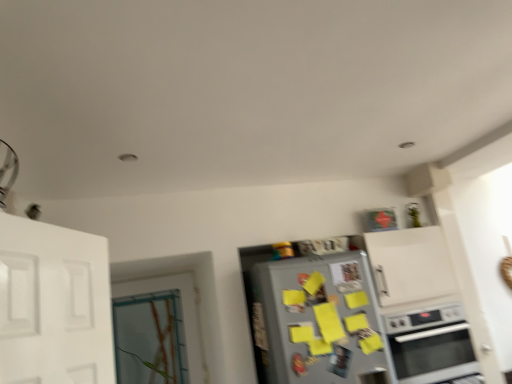
Question: From a real-world perspective, is satin silver oven at lower right located higher than silver metallic refrigerator at center?

Choices:
 (A) no
 (B) yes

Answer: (A)

Question: Is satin silver oven at lower right taller than silver metallic refrigerator at center?

Choices:
 (A) no
 (B) yes

Answer: (A)

Question: Does satin silver oven at lower right have a lesser width compared to silver metallic refrigerator at center?

Choices:
 (A) yes
 (B) no

Answer: (B)

Question: Is satin silver oven at lower right in contact with silver metallic refrigerator at center?

Choices:
 (A) yes
 (B) no

Answer: (B)

Question: Considering the relative sizes of satin silver oven at lower right and silver metallic refrigerator at center in the image provided, is satin silver oven at lower right shorter than silver metallic refrigerator at center?

Choices:
 (A) yes
 (B) no

Answer: (A)

Question: Based on their sizes in the image, would you say clear glass door at left is bigger or smaller than satin silver oven at lower right?

Choices:
 (A) small
 (B) big

Answer: (A)

Question: From a real-world perspective, relative to satin silver oven at lower right, is clear glass door at left vertically above or below?

Choices:
 (A) below
 (B) above

Answer: (B)

Question: From the image's perspective, is clear glass door at left located above or below satin silver oven at lower right?

Choices:
 (A) above
 (B) below

Answer: (A)

Question: Choose the correct answer: Is clear glass door at left inside satin silver oven at lower right or outside it?

Choices:
 (A) inside
 (B) outside

Answer: (B)

Question: Choose the correct answer: Is silver metallic refrigerator at center inside clear glass door at left or outside it?

Choices:
 (A) outside
 (B) inside

Answer: (A)

Question: From the image's perspective, is silver metallic refrigerator at center located above or below clear glass door at left?

Choices:
 (A) above
 (B) below

Answer: (A)

Question: Considering the positions of silver metallic refrigerator at center and clear glass door at left in the image, is silver metallic refrigerator at center taller or shorter than clear glass door at left?

Choices:
 (A) tall
 (B) short

Answer: (A)

Question: Does point (324, 269) appear closer or farther from the camera than point (135, 302)?

Choices:
 (A) closer
 (B) farther

Answer: (A)

Question: Does point (437, 339) appear closer or farther from the camera than point (178, 317)?

Choices:
 (A) farther
 (B) closer

Answer: (B)

Question: Is satin silver oven at lower right situated inside clear glass door at left or outside?

Choices:
 (A) inside
 (B) outside

Answer: (B)